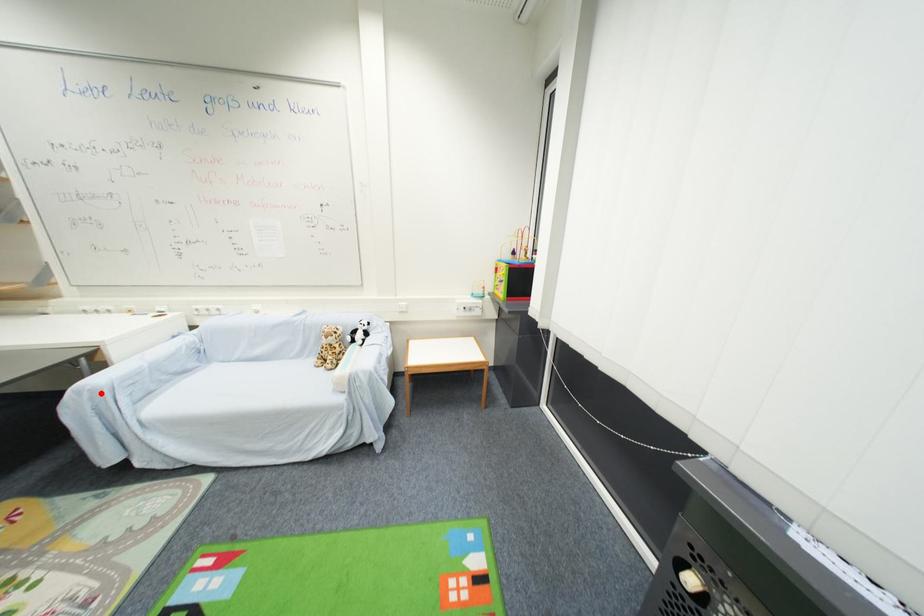
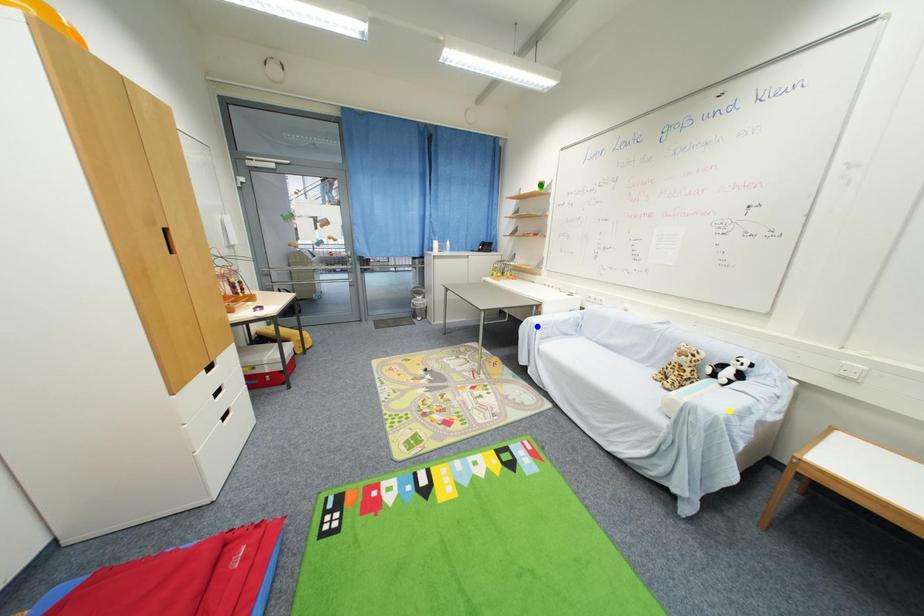
Question: I am providing you with two images of the same scene from different viewpoints. A red point is marked on the first image. You are given multiple points on the second image. Which point in image 2 is actually the same real-world point as the red point in image 1?

Choices:
 (A) blue point
 (B) yellow point
 (C) green point

Answer: (A)